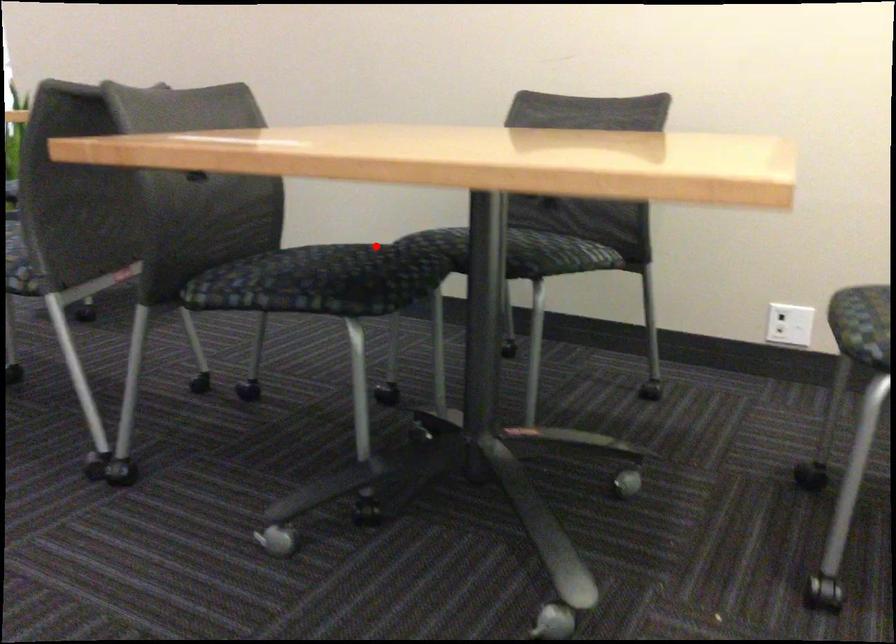
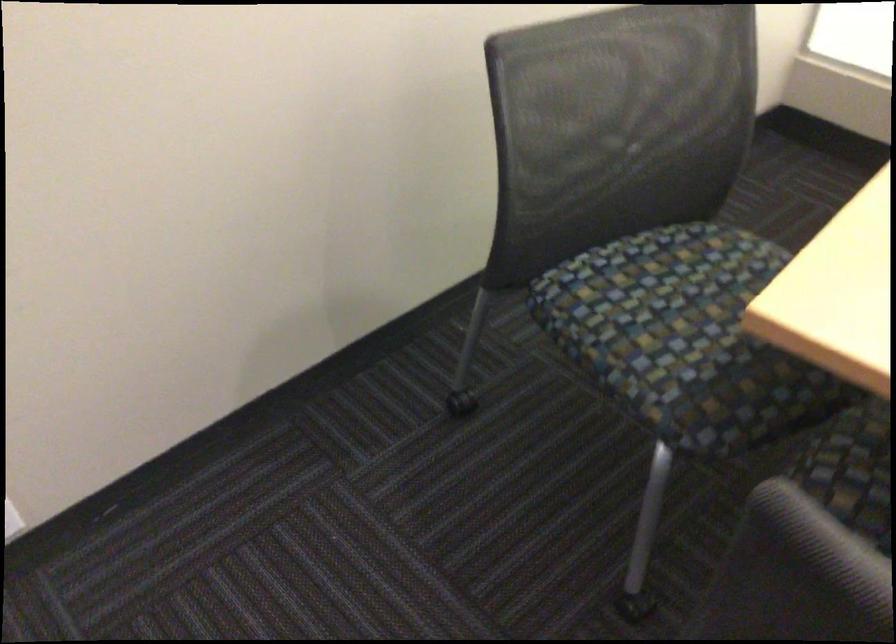
Locate, in the second image, the point that corresponds to the highlighted location in the first image.

(851, 469)